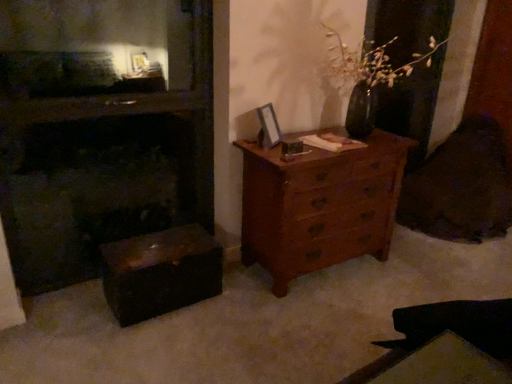
Question: Is shiny dark wood trunk at lower left at the right side of wooden picture frame at upper center?

Choices:
 (A) yes
 (B) no

Answer: (B)

Question: Could you tell me if shiny dark wood trunk at lower left is turned towards wooden picture frame at upper center?

Choices:
 (A) no
 (B) yes

Answer: (A)

Question: Is wooden picture frame at upper center located within shiny dark wood trunk at lower left?

Choices:
 (A) no
 (B) yes

Answer: (A)

Question: Considering the relative sizes of shiny dark wood trunk at lower left and wooden picture frame at upper center in the image provided, is shiny dark wood trunk at lower left bigger than wooden picture frame at upper center?

Choices:
 (A) no
 (B) yes

Answer: (B)

Question: From a real-world perspective, is shiny dark wood trunk at lower left over wooden picture frame at upper center?

Choices:
 (A) yes
 (B) no

Answer: (B)

Question: Is point (274, 135) positioned closer to the camera than point (0, 188)?

Choices:
 (A) farther
 (B) closer

Answer: (A)

Question: Is wooden picture frame at upper center situated inside dark wood fireplace at left or outside?

Choices:
 (A) outside
 (B) inside

Answer: (A)

Question: Considering the positions of wooden picture frame at upper center and dark wood fireplace at left in the image, is wooden picture frame at upper center taller or shorter than dark wood fireplace at left?

Choices:
 (A) tall
 (B) short

Answer: (B)

Question: From a real-world perspective, is wooden picture frame at upper center above or below dark wood fireplace at left?

Choices:
 (A) above
 (B) below

Answer: (A)

Question: From the image's perspective, is dark wood fireplace at left positioned above or below shiny dark wood trunk at lower left?

Choices:
 (A) above
 (B) below

Answer: (A)

Question: Is point (195, 26) closer or farther from the camera than point (116, 261)?

Choices:
 (A) closer
 (B) farther

Answer: (B)

Question: In terms of width, does dark wood fireplace at left look wider or thinner when compared to shiny dark wood trunk at lower left?

Choices:
 (A) thin
 (B) wide

Answer: (A)

Question: Would you say dark wood fireplace at left is to the left or to the right of shiny dark wood trunk at lower left in the picture?

Choices:
 (A) right
 (B) left

Answer: (B)

Question: Relative to dark wood fireplace at left, is wooden chest of drawers at right in front or behind?

Choices:
 (A) behind
 (B) front

Answer: (A)

Question: In terms of size, does wooden chest of drawers at right appear bigger or smaller than dark wood fireplace at left?

Choices:
 (A) big
 (B) small

Answer: (A)